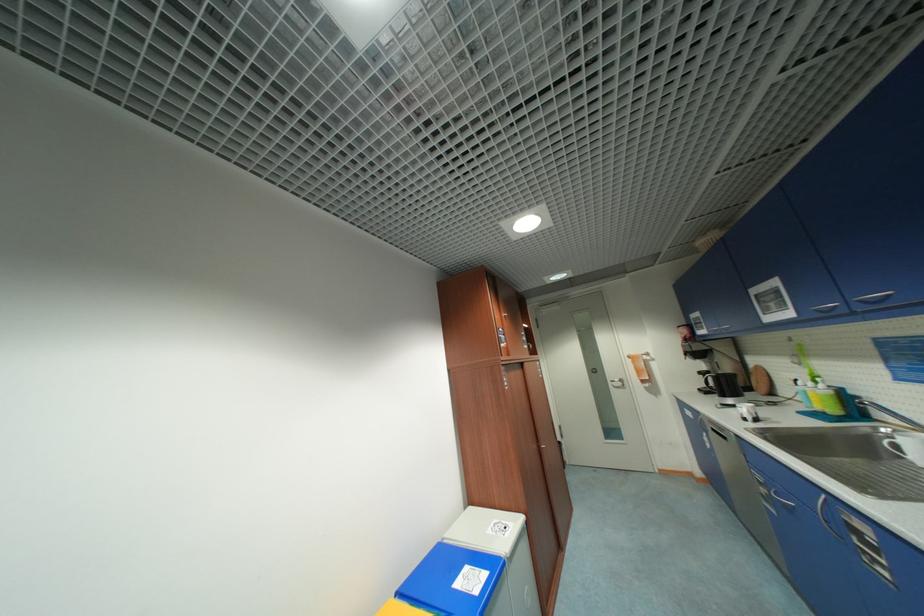
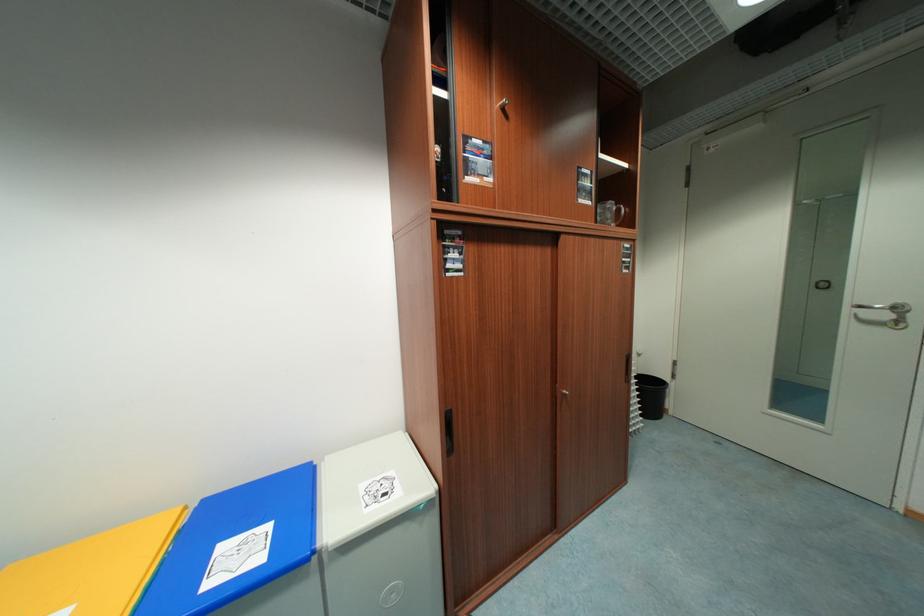
The point at (495, 533) is marked in the first image. Where is the corresponding point in the second image?

(369, 488)